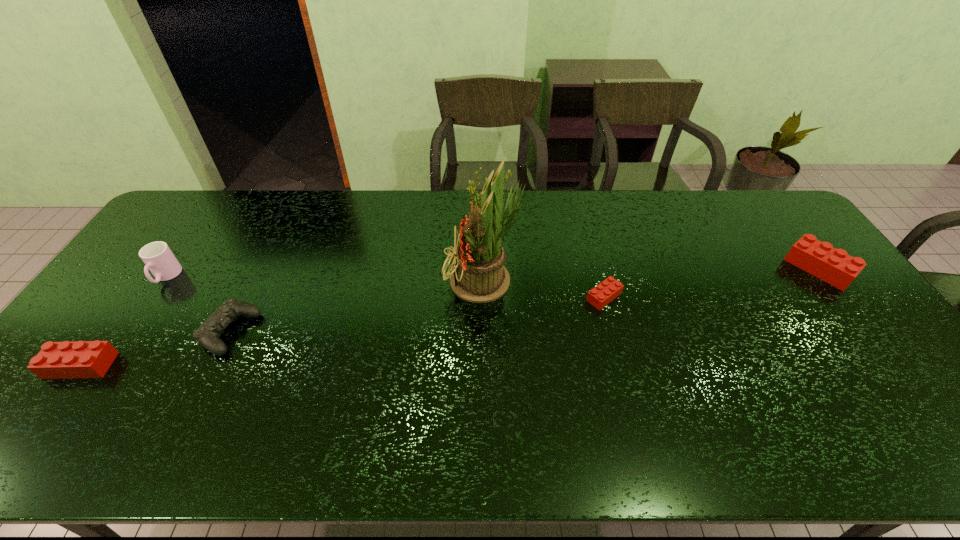
You are a GUI agent. You are given a task and a screenshot of the screen. Output one action in this format:
    pyautogui.click(x=<x>, y=<y>)
    Task: Click on the free space at the far edge of the desktop
    This screenshot has height=540, width=960.
    Given the screenshot: What is the action you would take?
    pyautogui.click(x=527, y=213)

At what (x,y) coordinates should I click in order to perform the action: click on free spot at the near edge of the desktop. Please return your answer as a coordinate pair (x, y). The height and width of the screenshot is (540, 960). Looking at the image, I should click on (493, 404).

In the image, there is a desktop. At what (x,y) coordinates should I click in order to perform the action: click on vacant area at the left edge. Please return your answer as a coordinate pair (x, y). Looking at the image, I should click on (151, 314).

Find the location of a particular element. This screenshot has height=540, width=960. vacant space at the right edge of the desktop is located at coordinates (850, 327).

Identify the location of free space at the far right corner of the desktop. Image resolution: width=960 pixels, height=540 pixels. (772, 215).

The width and height of the screenshot is (960, 540). I want to click on free spot between the rightmost Lego and the third object from right to left, so 653,275.

You are a GUI agent. You are given a task and a screenshot of the screen. Output one action in this format:
    pyautogui.click(x=<x>, y=<y>)
    Task: Click on the vacant region between the fourth object from right to left and the fifth object from left to right
    
    Given the screenshot: What is the action you would take?
    pyautogui.click(x=417, y=315)

I want to click on free space between the fourth object from right to left and the cup, so click(198, 305).

I want to click on empty space between the rightmost object and the tallest object, so click(x=653, y=275).

Identify the location of empty location between the second Lego from left to right and the control. The height and width of the screenshot is (540, 960). (417, 315).